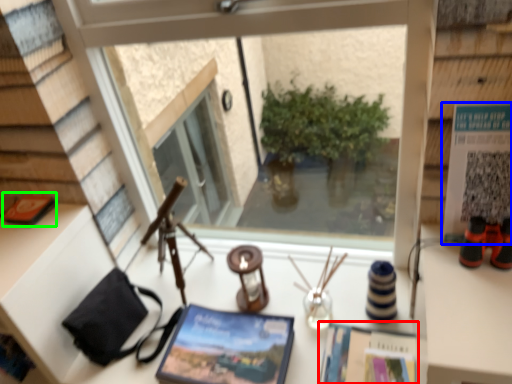
Question: Considering the real-world distances, which object is farthest from magazine (highlighted by a red box)? paperback book (highlighted by a blue box) or book (highlighted by a green box)?

Choices:
 (A) paperback book
 (B) book

Answer: (B)